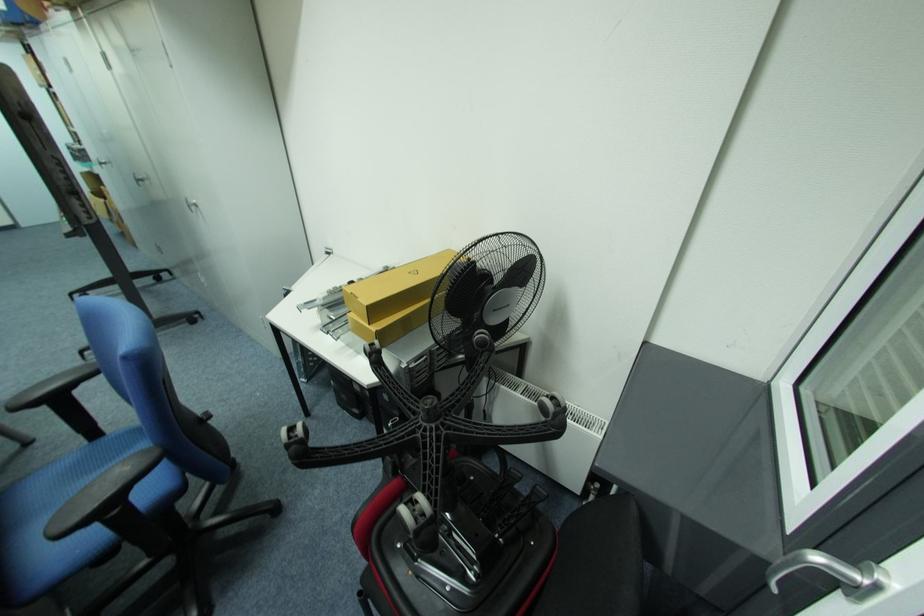
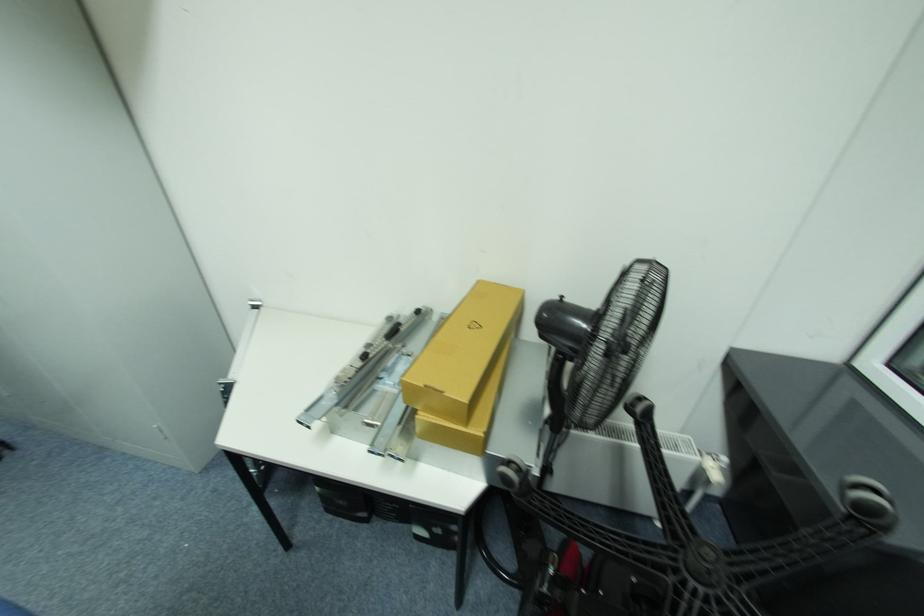
Looking at this image, in a continuous first-person perspective shot, in which direction is the camera moving?

The cameraman walked toward left, forward.